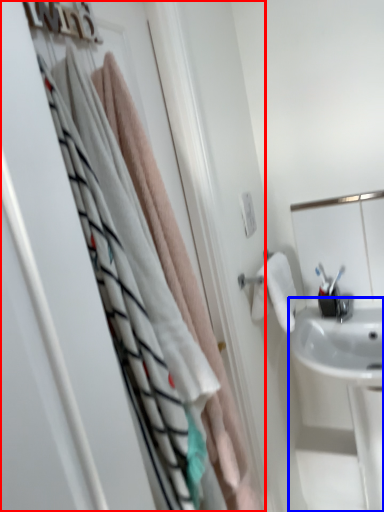
Question: Which object appears farthest to the camera in this image, closet (highlighted by a red box) or sink (highlighted by a blue box)?

Choices:
 (A) closet
 (B) sink

Answer: (B)